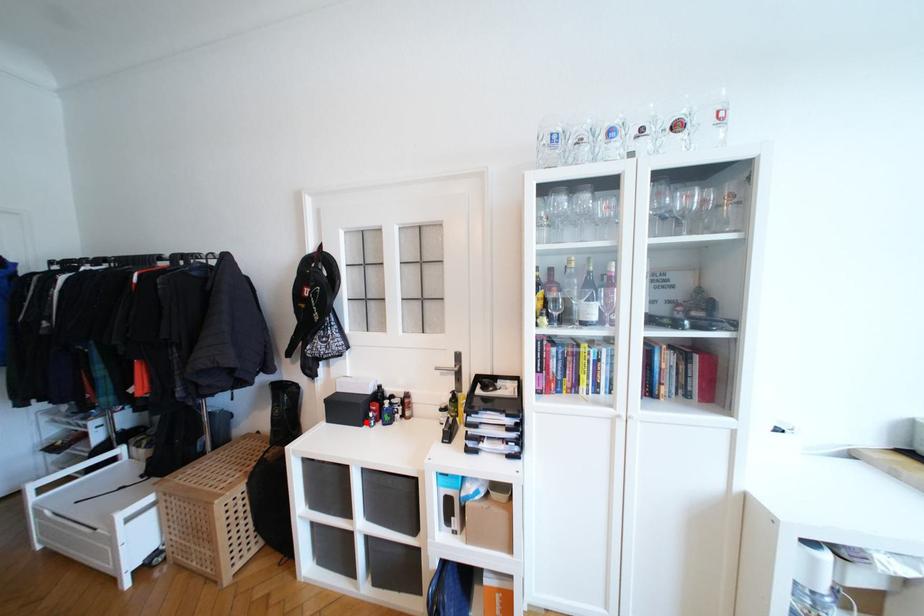
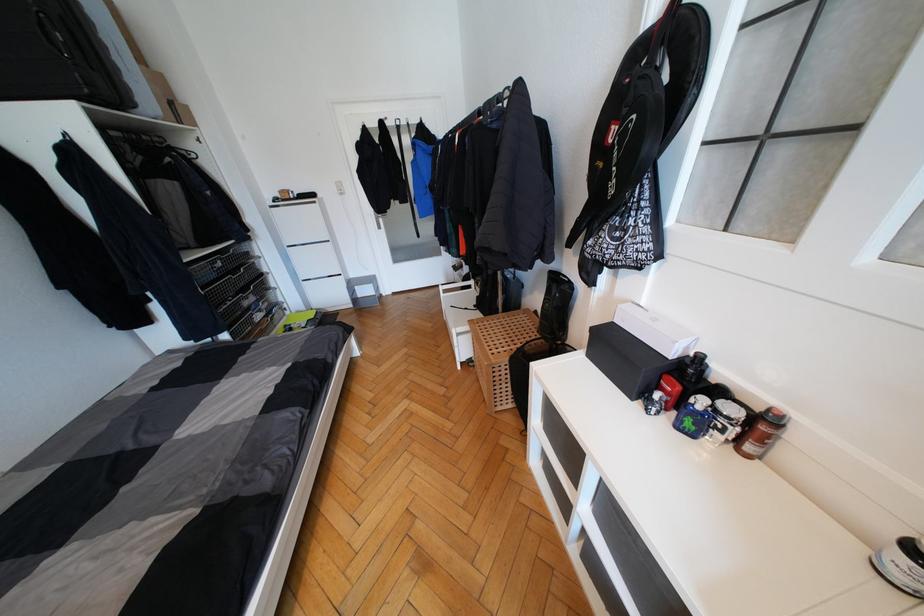
Question: I am providing you with two images of the same scene from different viewpoints. Image1 has a red point marked. In image2, the corresponding 3D location appears at what relative position? Reply with the corresponding letter.

Choices:
 (A) Closer
 (B) Farther

Answer: (A)